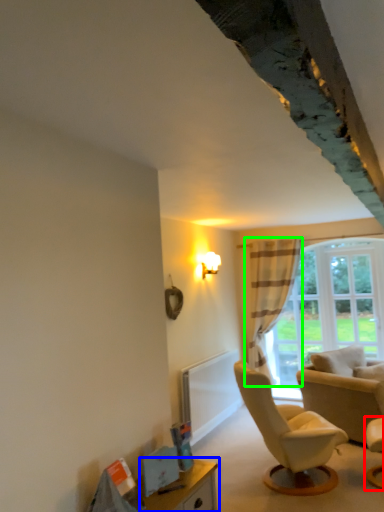
Question: Which object is the closest to the chair (highlighted by a red box)? Choose among these: table (highlighted by a blue box) or curtain (highlighted by a green box).

Choices:
 (A) table
 (B) curtain

Answer: (A)